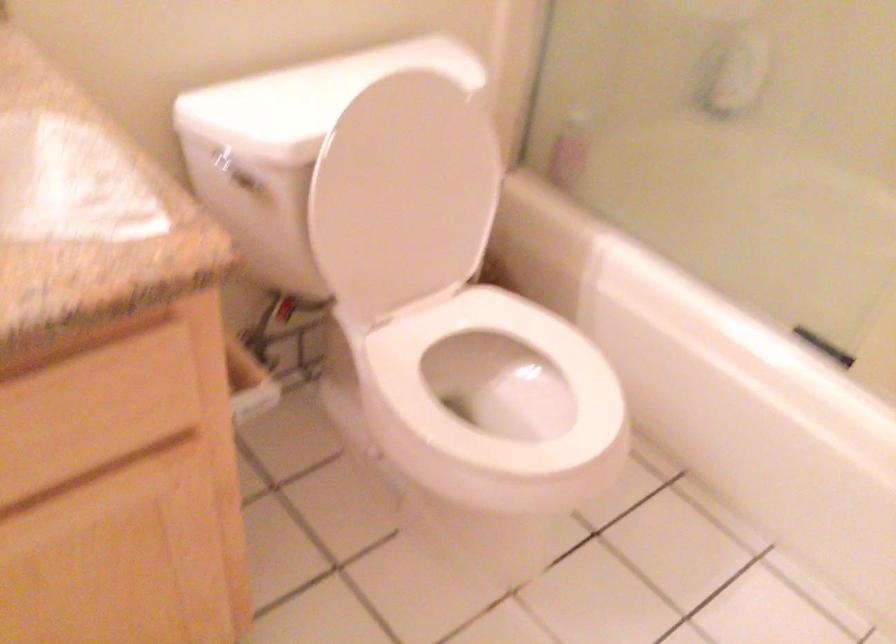
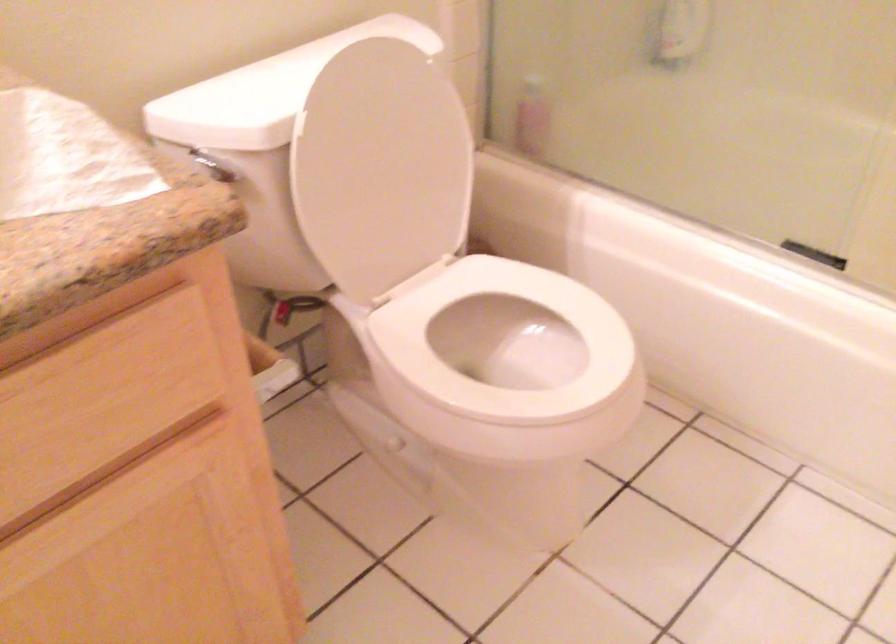
Question: The images are taken continuously from a first-person perspective. In which direction are you moving?

Choices:
 (A) Left
 (B) Right
 (C) Forward
 (D) Backward

Answer: (A)